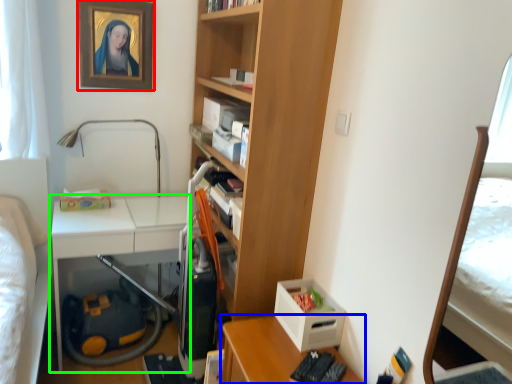
Question: Estimate the real-world distances between objects in this image. Which object is closer to picture frame (highlighted by a red box), desk (highlighted by a blue box) or table (highlighted by a green box)?

Choices:
 (A) desk
 (B) table

Answer: (B)